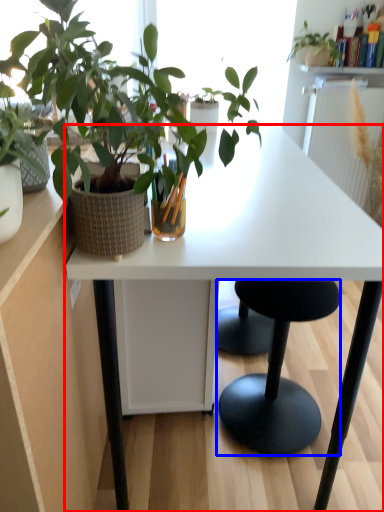
Question: Which point is further to the camera, desk (highlighted by a red box) or stool (highlighted by a blue box)?

Choices:
 (A) desk
 (B) stool

Answer: (B)